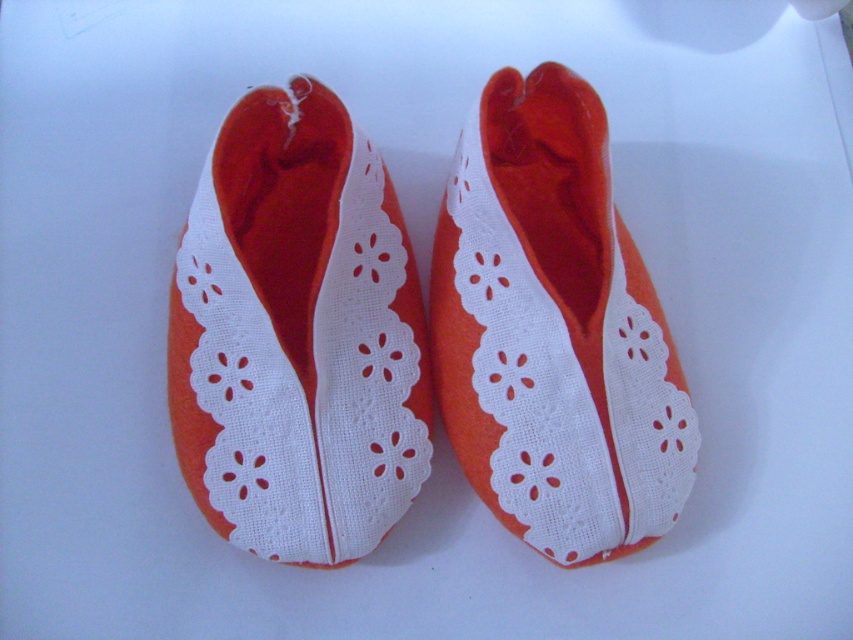
Is orange fabric shoe at center wider than orange felt slipper at center?

No, orange fabric shoe at center is not wider than orange felt slipper at center.

The height and width of the screenshot is (640, 853). What are the coordinates of `orange fabric shoe at center` in the screenshot? It's located at (297, 336).

You are a GUI agent. You are given a task and a screenshot of the screen. Output one action in this format:
    pyautogui.click(x=<x>, y=<y>)
    Task: Click on the orange fabric shoe at center
    
    Given the screenshot: What is the action you would take?
    pyautogui.click(x=297, y=336)